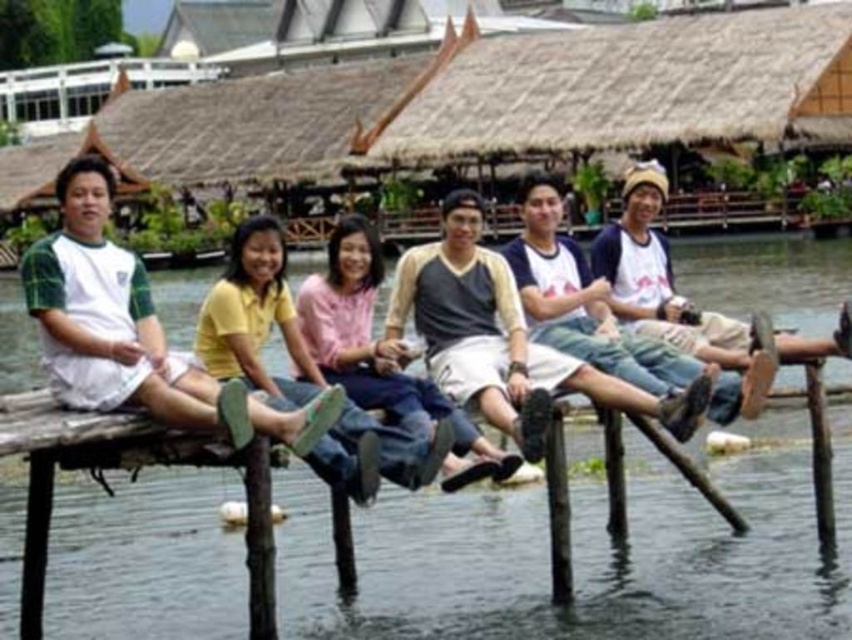
Question: Estimate the real-world distances between objects in this image. Which object is farther from the yellow matte shirt at center?

Choices:
 (A) white-green striped shirt at left
 (B) pink fabric shirt at center
 (C) clear blue water at center

Answer: (C)

Question: Can you confirm if yellow matte shirt at center is positioned to the left of pink fabric shirt at center?

Choices:
 (A) no
 (B) yes

Answer: (B)

Question: Is white-green striped shirt at left thinner than yellow matte shirt at center?

Choices:
 (A) yes
 (B) no

Answer: (B)

Question: Which object is farther from the camera taking this photo?

Choices:
 (A) clear blue water at center
 (B) pink fabric shirt at center

Answer: (A)

Question: Which of the following is the closest to the observer?

Choices:
 (A) (222, 317)
 (B) (321, 333)

Answer: (A)

Question: Does white-green striped shirt at left have a larger size compared to pink fabric shirt at center?

Choices:
 (A) yes
 (B) no

Answer: (A)